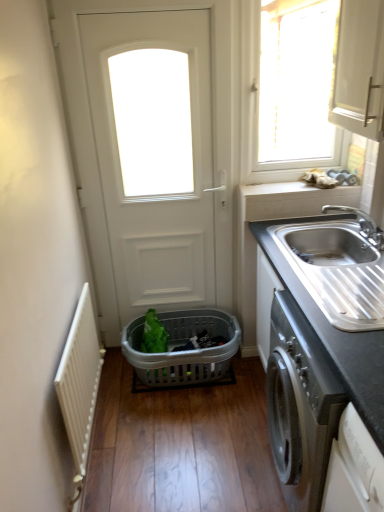
Locate an element on the screen. free spot in front of gray plastic basket at center is located at coordinates (180, 438).